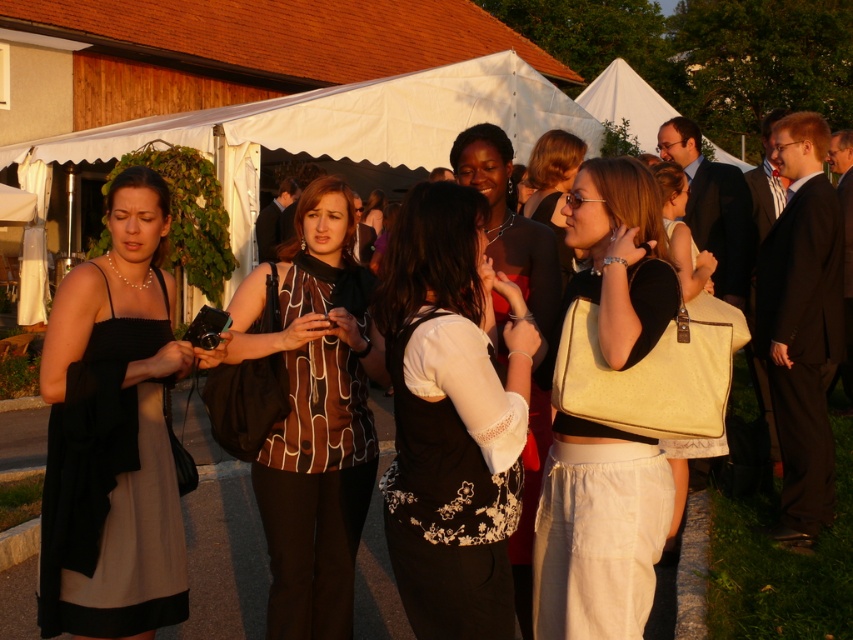
Which is below, white floral vest at center or matte cream purse at center?

Positioned lower is white floral vest at center.

Identify the location of white floral vest at center. The height and width of the screenshot is (640, 853). (450, 419).

Identify the location of white floral vest at center. The height and width of the screenshot is (640, 853). click(450, 419).

Based on the photo, does matte cream purse at center lie behind matte black dress at left?

No, matte cream purse at center is in front of matte black dress at left.

Find the location of a particular element. This screenshot has width=853, height=640. matte cream purse at center is located at coordinates coord(598,531).

Consider the image. Is matte black dress at left wider than matte black dress at center?

Incorrect, matte black dress at left's width does not surpass matte black dress at center's.

Who is more forward, (144, 604) or (502, 237)?

Point (144, 604) is in front.

The height and width of the screenshot is (640, 853). In order to click on matte black dress at left in this screenshot , I will do `click(111, 493)`.